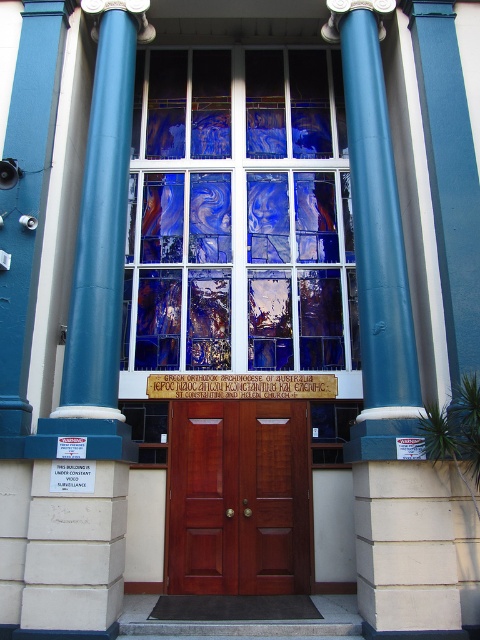
You are standing at the entrance of the Greek Orthodox Archdiocese of Australia St. Constantine and Helen Church. You see a point marked at coordinate (90, 372). Which object from the scene does this point belong to?

The point at coordinate (90, 372) is on the smooth blue column at left.

You are a delivery person standing at the entrance of the church. You need to place a package on the ground between the blue stained glass at center and the mahogany wood door at center. Can you fit the package there if it requires 7 feet of space?

The blue stained glass at center and mahogany wood door at center are 7.41 feet apart, so yes, the package requiring 7 feet of space can fit between them.

Based on the photo, you are standing at the entrance of the church and want to touch both the teal polished column at center and the mahogany wood door at center. Which object will you reach first?

The teal polished column at center is closer to the viewer than the mahogany wood door at center, so you will reach the teal polished column at center first.